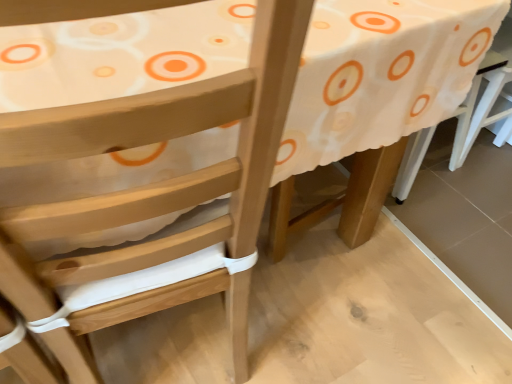
Question: Is point (472, 13) closer or farther from the camera than point (454, 147)?

Choices:
 (A) farther
 (B) closer

Answer: (B)

Question: Visually, is wooden table at center positioned to the left or to the right of white plastic chair at right?

Choices:
 (A) right
 (B) left

Answer: (B)

Question: From the image's perspective, is wooden table at center located above or below white plastic chair at right?

Choices:
 (A) below
 (B) above

Answer: (A)

Question: From a real-world perspective, is white plastic chair at right above or below wooden table at center?

Choices:
 (A) below
 (B) above

Answer: (A)

Question: Visually, is white plastic chair at right positioned to the left or to the right of wooden table at center?

Choices:
 (A) right
 (B) left

Answer: (A)

Question: From the image's perspective, is white plastic chair at right positioned above or below wooden table at center?

Choices:
 (A) above
 (B) below

Answer: (A)

Question: Is white plastic chair at right in front of or behind wooden table at center in the image?

Choices:
 (A) front
 (B) behind

Answer: (B)